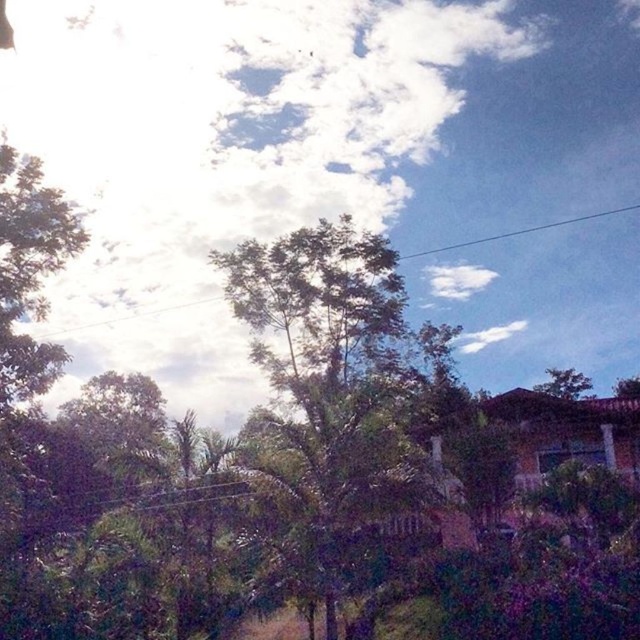
Measure the distance between green leafy tree at center and green leafy tree at upper right.

They are 30.07 meters apart.

Can you confirm if green leafy tree at center is shorter than green leafy tree at upper right?

No, green leafy tree at center is not shorter than green leafy tree at upper right.

This screenshot has height=640, width=640. Find the location of `green leafy tree at center`. green leafy tree at center is located at coordinates (337, 406).

At what (x,y) coordinates should I click in order to perform the action: click on green leafy tree at center. Please return your answer as a coordinate pair (x, y). The image size is (640, 640). Looking at the image, I should click on tap(337, 406).

Does point (444, 99) lie in front of point (577, 388)?

No, it is behind (577, 388).

Does white fluffy cloud at upper center come in front of green leafy tree at upper right?

Yes, white fluffy cloud at upper center is in front of green leafy tree at upper right.

Who is more distant from viewer, (400, 134) or (554, 378)?

The point (400, 134) is behind.

At what (x,y) coordinates should I click in order to perform the action: click on white fluffy cloud at upper center. Please return your answer as a coordinate pair (x, y). This screenshot has height=640, width=640. Looking at the image, I should click on (221, 152).

Consider the image. Does white fluffy cloud at upper center have a greater height compared to green leafy tree at center?

Yes.

Who is positioned more to the right, white fluffy cloud at upper center or green leafy tree at center?

Positioned to the right is green leafy tree at center.

Between point (326, 93) and point (323, 561), which one is positioned in front?

Point (323, 561) is more forward.

This screenshot has width=640, height=640. Find the location of `white fluffy cloud at upper center`. white fluffy cloud at upper center is located at coordinates (221, 152).